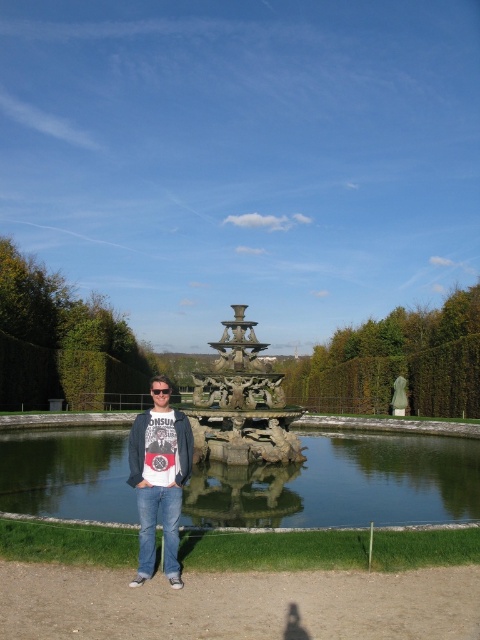
Does denim jacket at center have a larger size compared to white cotton t-shirt at center?

Indeed, denim jacket at center has a larger size compared to white cotton t-shirt at center.

The width and height of the screenshot is (480, 640). What do you see at coordinates (158, 477) in the screenshot?
I see `denim jacket at center` at bounding box center [158, 477].

You are a GUI agent. You are given a task and a screenshot of the screen. Output one action in this format:
    pyautogui.click(x=<x>, y=<y>)
    Task: Click on the denim jacket at center
    The height and width of the screenshot is (640, 480).
    Given the screenshot: What is the action you would take?
    pyautogui.click(x=158, y=477)

Find the location of a particular element. The width and height of the screenshot is (480, 640). denim jacket at center is located at coordinates (158, 477).

Does point (132, 515) come farther from viewer compared to point (251, 442)?

No, it is in front of (251, 442).

This screenshot has width=480, height=640. Describe the element at coordinates (344, 484) in the screenshot. I see `clear glass water at center` at that location.

Where is `clear glass water at center`? clear glass water at center is located at coordinates (344, 484).

In the scene shown: Does clear glass water at center have a greater width compared to white cotton t-shirt at center?

Yes, clear glass water at center is wider than white cotton t-shirt at center.

Who is shorter, clear glass water at center or white cotton t-shirt at center?

clear glass water at center

Locate an element on the screen. This screenshot has width=480, height=640. clear glass water at center is located at coordinates (344, 484).